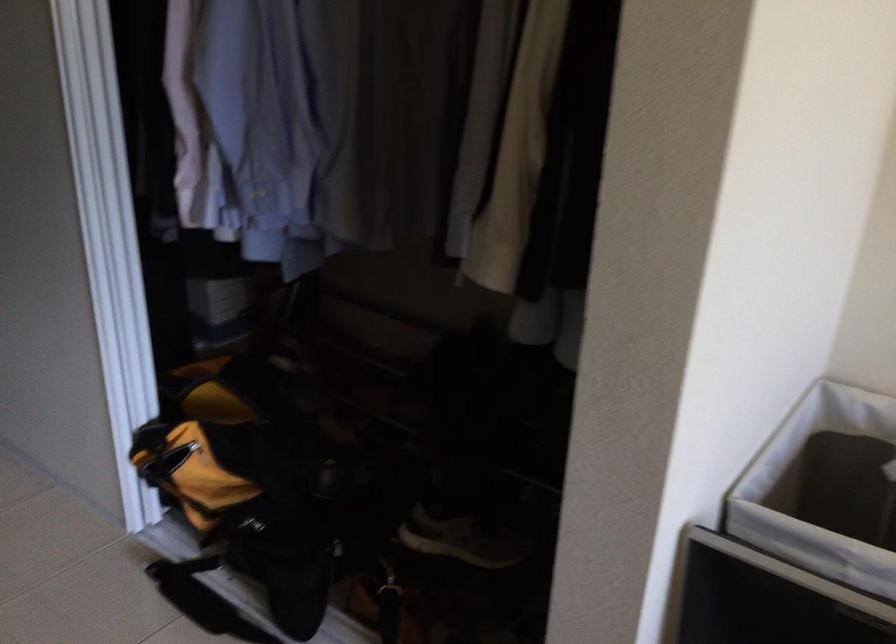
The image size is (896, 644). Find the location of `gray sneaker`. gray sneaker is located at coordinates (461, 540).